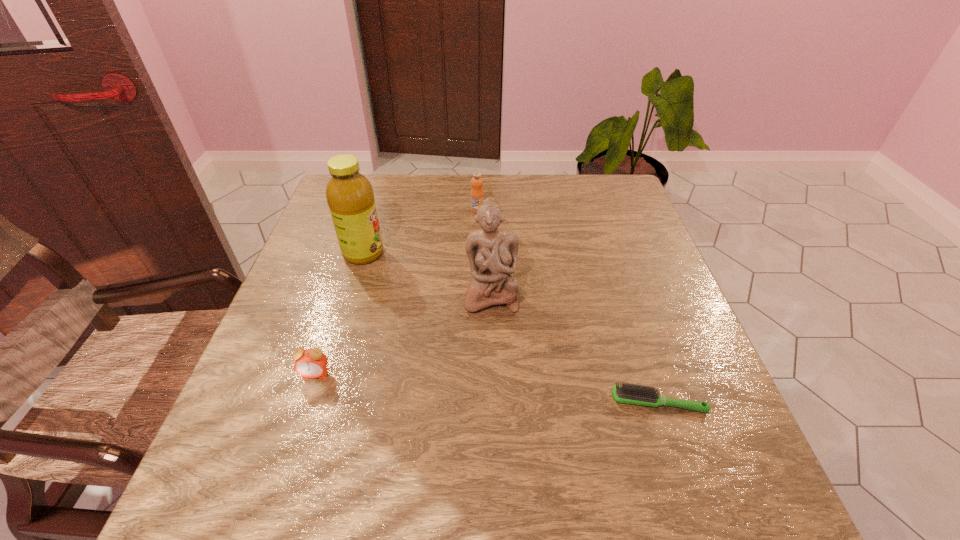
At what (x,y) coordinates should I click in order to perform the action: click on the fourth nearest object. Please return your answer as a coordinate pair (x, y). Looking at the image, I should click on (350, 197).

At what (x,y) coordinates should I click in order to perform the action: click on the third nearest object. Please return your answer as a coordinate pair (x, y). Image resolution: width=960 pixels, height=540 pixels. Looking at the image, I should click on (492, 252).

This screenshot has height=540, width=960. I want to click on the farthest object, so click(477, 195).

At what (x,y) coordinates should I click in order to perform the action: click on orange juice. Please return your answer as a coordinate pair (x, y). The image size is (960, 540). Looking at the image, I should click on (477, 195).

What are the coordinates of `the second nearest object` in the screenshot? It's located at (309, 363).

This screenshot has height=540, width=960. I want to click on the second shortest object, so click(x=309, y=363).

In order to click on the nearest object in this screenshot , I will do `click(629, 393)`.

Locate an element on the screen. The image size is (960, 540). the rightmost object is located at coordinates (629, 393).

The image size is (960, 540). What are the coordinates of `vacant space located on the front label of the fruit juice` in the screenshot? It's located at (500, 253).

Find the location of a particular element. The height and width of the screenshot is (540, 960). vacant region located on the front-facing side of the third farthest object is located at coordinates (492, 333).